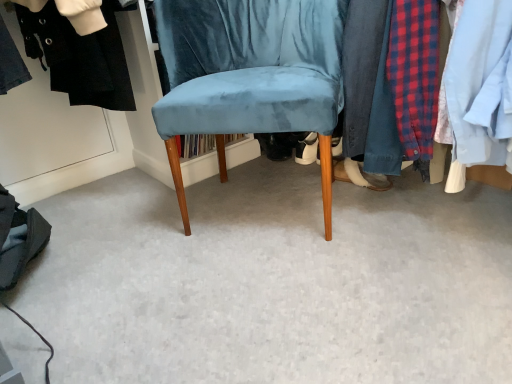
The image size is (512, 384). I want to click on free point to the left of velvet blue chair at center, so click(123, 220).